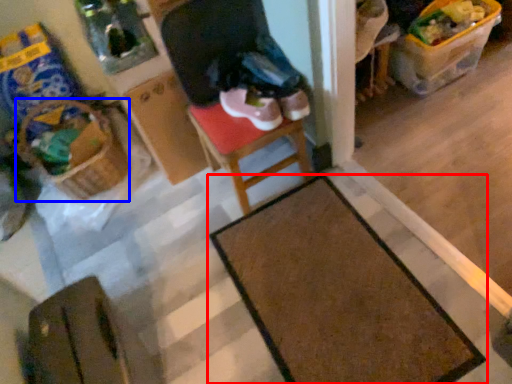
Question: Among these objects, which one is farthest to the camera, table (highlighted by a red box) or basket (highlighted by a blue box)?

Choices:
 (A) table
 (B) basket

Answer: (B)